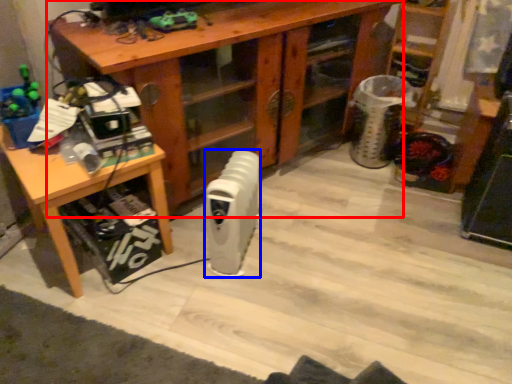
Question: Among these objects, which one is nearest to the camera, desk (highlighted by a red box) or radiator (highlighted by a blue box)?

Choices:
 (A) desk
 (B) radiator

Answer: (A)